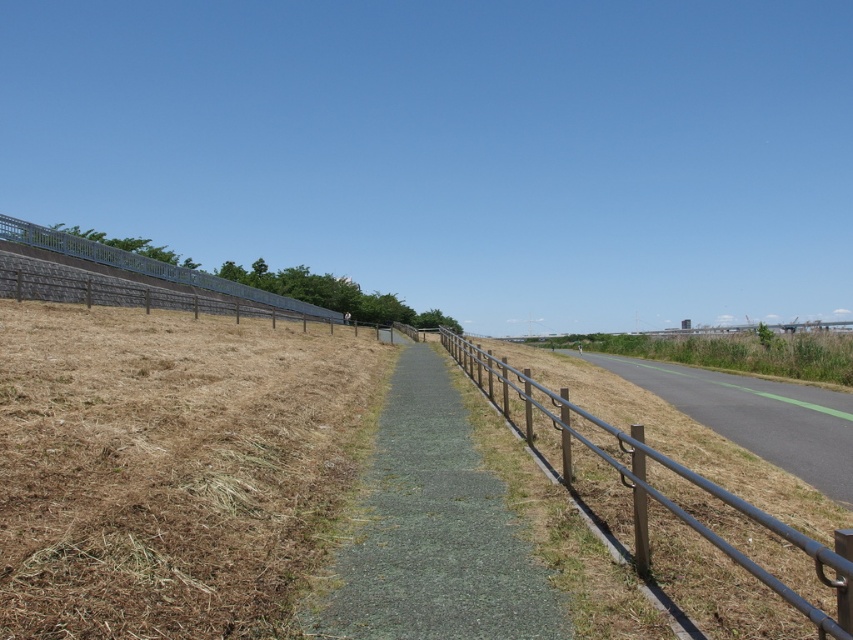
Question: Does brown dry grass at left have a greater width compared to gray asphalt path at center?

Choices:
 (A) no
 (B) yes

Answer: (B)

Question: Among these points, which one is farthest from the camera?

Choices:
 (A) (840, 563)
 (B) (305, 305)

Answer: (B)

Question: Estimate the real-world distances between objects in this image. Which object is closer to the metallic gray fence at center?

Choices:
 (A) metallic gray fence at upper left
 (B) metallic gray path at right

Answer: (B)

Question: Which object is closer to the camera taking this photo?

Choices:
 (A) gray asphalt path at center
 (B) metallic gray fence at upper left

Answer: (A)

Question: Is brown dry grass at left behind metallic gray fence at center?

Choices:
 (A) yes
 (B) no

Answer: (A)

Question: Is brown dry grass at left above metallic gray path at right?

Choices:
 (A) no
 (B) yes

Answer: (B)